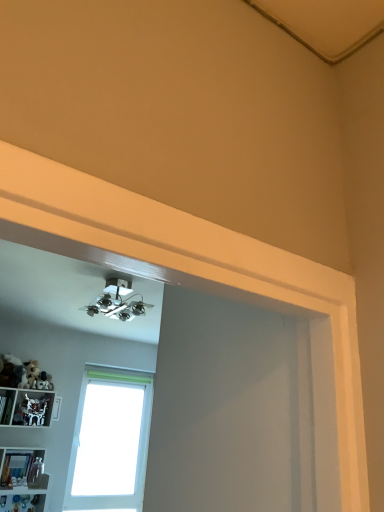
In order to face white plastic shelf at lower left, which is the second shelf from bottom to top, should I rotate leftwards or rightwards?

A 21.533 degree turn to the left will do.

Image resolution: width=384 pixels, height=512 pixels. Describe the element at coordinates (22, 468) in the screenshot. I see `translucent plastic bottles at lower left, the 2th shelf when ordered from top to bottom` at that location.

Consider the image. How much space does translucent plastic bottles at lower left, the 2th shelf when ordered from top to bottom, occupy horizontally?

translucent plastic bottles at lower left, the 2th shelf when ordered from top to bottom, is 15.99 centimeters in width.

You are a GUI agent. You are given a task and a screenshot of the screen. Output one action in this format:
    pyautogui.click(x=<x>, y=<y>)
    Task: Click on the white plastic shelf at lower left, which is the second shelf from bottom to top
    
    Given the screenshot: What is the action you would take?
    pyautogui.click(x=26, y=407)

Is translucent plastic bottles at lower left, the 2th shelf when ordered from top to bottom, to the right of white frosted glass window at center from the viewer's perspective?

No.

Which is correct: translucent plastic bottles at lower left, the 2th shelf when ordered from top to bottom, is inside white frosted glass window at center, or outside of it?

translucent plastic bottles at lower left, the 2th shelf when ordered from top to bottom, exists outside the volume of white frosted glass window at center.

In order to click on shelf directly beneath the white frosted glass window at center (from a real-world perspective) in this screenshot , I will do `click(22, 468)`.

From the image's perspective, would you say translucent plastic bottles at lower left, acting as the first shelf starting from the bottom, is shown under white frosted glass window at center?

No, from the image's perspective, translucent plastic bottles at lower left, acting as the first shelf starting from the bottom, is not below white frosted glass window at center.

Which of these two, white frosted glass window at center or translucent plastic bottles at lower left, the 2th shelf when ordered from top to bottom, stands taller?

With more height is white frosted glass window at center.

Is white frosted glass window at center aimed at translucent plastic bottles at lower left, acting as the first shelf starting from the bottom?

No, white frosted glass window at center is not turned towards translucent plastic bottles at lower left, acting as the first shelf starting from the bottom.

Is white frosted glass window at center not inside translucent plastic bottles at lower left, acting as the first shelf starting from the bottom?

Yes, white frosted glass window at center is located beyond the bounds of translucent plastic bottles at lower left, acting as the first shelf starting from the bottom.

Does point (48, 391) appear closer or farther from the camera than point (33, 461)?

Clearly, point (48, 391) is more distant from the camera than point (33, 461).

In the image, there is a translucent plastic bottles at lower left, acting as the first shelf starting from the bottom. At what (x,y) coordinates should I click in order to perform the action: click on shelf above it (from the image's perspective). Please return your answer as a coordinate pair (x, y). This screenshot has width=384, height=512. Looking at the image, I should click on click(26, 407).

From a real-world perspective, which object rests below the other?

From a 3D spatial view, translucent plastic bottles at lower left, the 2th shelf when ordered from top to bottom, is below.

Would you consider white plastic shelf at lower left, which is the second shelf from bottom to top, to be distant from translucent plastic bottles at lower left, acting as the first shelf starting from the bottom?

Actually, white plastic shelf at lower left, which is the second shelf from bottom to top, and translucent plastic bottles at lower left, acting as the first shelf starting from the bottom, are a little close together.

From a real-world perspective, is white plastic shelf at lower left, which is the second shelf from bottom to top, physically located above or below white frosted glass window at center?

In terms of real-world spatial position, white plastic shelf at lower left, which is the second shelf from bottom to top, is above white frosted glass window at center.

Is white frosted glass window at center completely or partially inside white plastic shelf at lower left, which is the second shelf from bottom to top?

No, white frosted glass window at center is not inside white plastic shelf at lower left, which is the second shelf from bottom to top.

Identify the location of shelf above the white frosted glass window at center (from a real-world perspective). (26, 407).

From the image's perspective, is white plastic shelf at lower left, arranged as the first shelf when viewed from the top, over white frosted glass window at center?

Yes, from the image's perspective, white plastic shelf at lower left, arranged as the first shelf when viewed from the top, is on top of white frosted glass window at center.

Does white frosted glass window at center have a lesser height compared to white plastic shelf at lower left, which is the second shelf from bottom to top?

In fact, white frosted glass window at center may be taller than white plastic shelf at lower left, which is the second shelf from bottom to top.

In the scene shown: Is white plastic shelf at lower left, which is the second shelf from bottom to top, at the back of white frosted glass window at center?

No, white frosted glass window at center is not facing the opposite direction of white plastic shelf at lower left, which is the second shelf from bottom to top.

Looking at this image, does white frosted glass window at center appear on the right side of white plastic shelf at lower left, which is the second shelf from bottom to top?

Yes, white frosted glass window at center is to the right of white plastic shelf at lower left, which is the second shelf from bottom to top.

The image size is (384, 512). In order to click on window below the white plastic shelf at lower left, which is the second shelf from bottom to top (from the image's perspective) in this screenshot , I will do `click(110, 441)`.

Does translucent plastic bottles at lower left, acting as the first shelf starting from the bottom, have a lesser height compared to white plastic shelf at lower left, arranged as the first shelf when viewed from the top?

Yes, translucent plastic bottles at lower left, acting as the first shelf starting from the bottom, is shorter than white plastic shelf at lower left, arranged as the first shelf when viewed from the top.

Is translucent plastic bottles at lower left, acting as the first shelf starting from the bottom, aimed at white plastic shelf at lower left, which is the second shelf from bottom to top?

No, translucent plastic bottles at lower left, acting as the first shelf starting from the bottom, does not turn towards white plastic shelf at lower left, which is the second shelf from bottom to top.

From the image's perspective, would you say translucent plastic bottles at lower left, acting as the first shelf starting from the bottom, is shown under white plastic shelf at lower left, arranged as the first shelf when viewed from the top?

Indeed, from the image's perspective, translucent plastic bottles at lower left, acting as the first shelf starting from the bottom, is shown beneath white plastic shelf at lower left, arranged as the first shelf when viewed from the top.

Do you think translucent plastic bottles at lower left, the 2th shelf when ordered from top to bottom, is within white plastic shelf at lower left, arranged as the first shelf when viewed from the top, or outside of it?

translucent plastic bottles at lower left, the 2th shelf when ordered from top to bottom, is spatially situated outside white plastic shelf at lower left, arranged as the first shelf when viewed from the top.

In the image, there is a white frosted glass window at center. Identify the location of shelf below it (from a real-world perspective). (22, 468).

You are a GUI agent. You are given a task and a screenshot of the screen. Output one action in this format:
    pyautogui.click(x=<x>, y=<y>)
    Task: Click on the 1st shelf above the white frosted glass window at center (from the image's perspective)
    
    Given the screenshot: What is the action you would take?
    pyautogui.click(x=22, y=468)

From the image, which object appears to be farther from translucent plastic bottles at lower left, acting as the first shelf starting from the bottom, white plastic shelf at lower left, arranged as the first shelf when viewed from the top, or white frosted glass window at center?

The object further to translucent plastic bottles at lower left, acting as the first shelf starting from the bottom, is white frosted glass window at center.

Which object lies further to the anchor point white plastic shelf at lower left, which is the second shelf from bottom to top, white frosted glass window at center or translucent plastic bottles at lower left, the 2th shelf when ordered from top to bottom?

white frosted glass window at center is further to white plastic shelf at lower left, which is the second shelf from bottom to top.

Looking at the image, which one is located closer to white frosted glass window at center, translucent plastic bottles at lower left, acting as the first shelf starting from the bottom, or white plastic shelf at lower left, which is the second shelf from bottom to top?

white plastic shelf at lower left, which is the second shelf from bottom to top, lies closer to white frosted glass window at center than the other object.

Looking at the image, which one is located closer to white plastic shelf at lower left, arranged as the first shelf when viewed from the top, translucent plastic bottles at lower left, acting as the first shelf starting from the bottom, or white frosted glass window at center?

Among the two, translucent plastic bottles at lower left, acting as the first shelf starting from the bottom, is located nearer to white plastic shelf at lower left, arranged as the first shelf when viewed from the top.

From the image, which object appears to be nearer to translucent plastic bottles at lower left, acting as the first shelf starting from the bottom, white frosted glass window at center or white plastic shelf at lower left, arranged as the first shelf when viewed from the top?

white plastic shelf at lower left, arranged as the first shelf when viewed from the top, is closer to translucent plastic bottles at lower left, acting as the first shelf starting from the bottom.

Considering their positions, is white plastic shelf at lower left, arranged as the first shelf when viewed from the top, positioned further to white frosted glass window at center than translucent plastic bottles at lower left, the 2th shelf when ordered from top to bottom?

translucent plastic bottles at lower left, the 2th shelf when ordered from top to bottom, is further to white frosted glass window at center.

Find the location of `shelf between white plastic shelf at lower left, arranged as the first shelf when viewed from the top, and white frosted glass window at center`. shelf between white plastic shelf at lower left, arranged as the first shelf when viewed from the top, and white frosted glass window at center is located at coordinates [x=22, y=468].